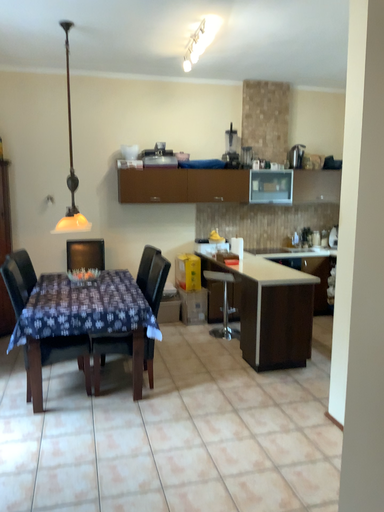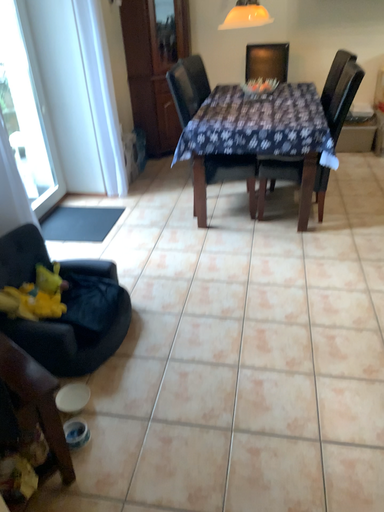
Question: Which way did the camera rotate in the video?

Choices:
 (A) rotated right
 (B) rotated left

Answer: (B)